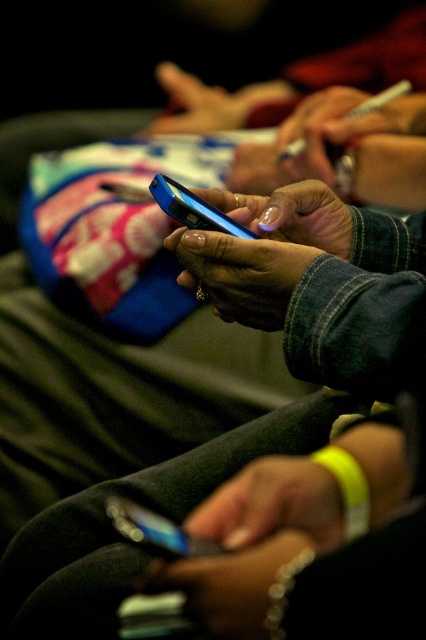
Question: Which object is positioned closest to the shiny blue phone at center?

Choices:
 (A) matte black phone at center
 (B) matte blue phone at center

Answer: (A)

Question: Is matte blue phone at center thinner than shiny blue phone at center?

Choices:
 (A) yes
 (B) no

Answer: (B)

Question: Does matte black phone at center appear over shiny blue phone at center?

Choices:
 (A) no
 (B) yes

Answer: (A)

Question: Is matte black phone at center further to camera compared to shiny blue phone at center?

Choices:
 (A) yes
 (B) no

Answer: (B)

Question: Which object is positioned farthest from the matte blue phone at center?

Choices:
 (A) matte black phone at center
 (B) shiny blue phone at center

Answer: (A)

Question: Which object is farther from the camera taking this photo?

Choices:
 (A) shiny blue phone at center
 (B) matte black phone at center
 (C) matte blue phone at center

Answer: (C)